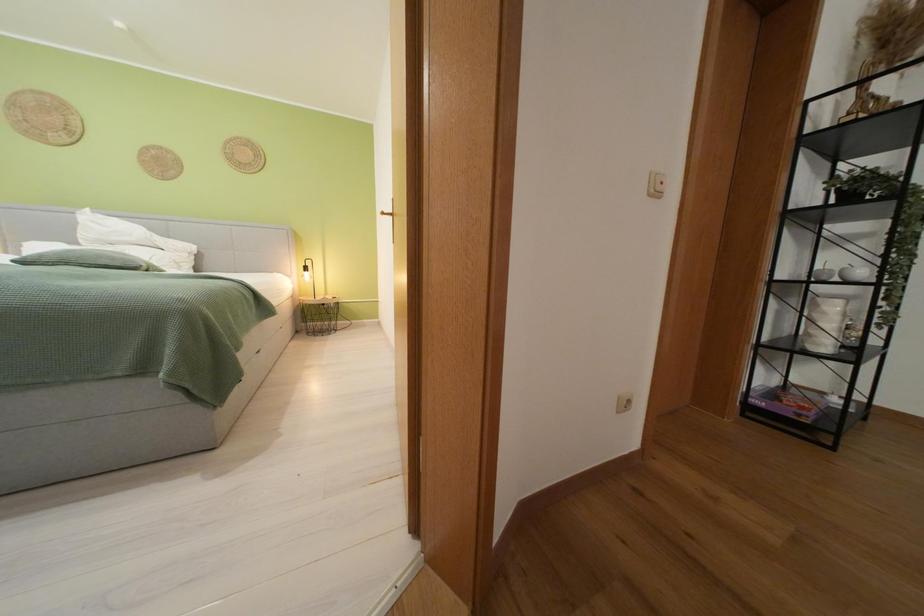
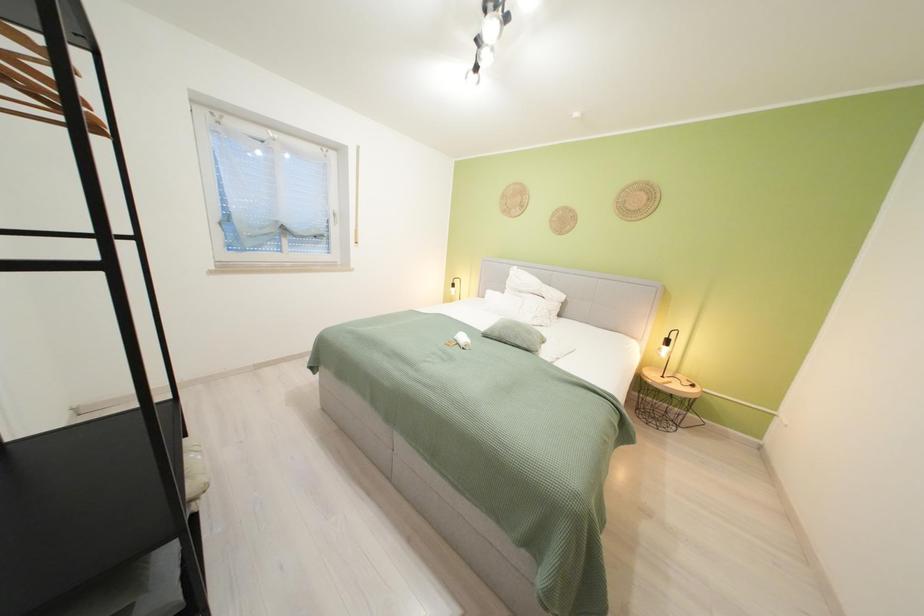
Question: Based on the continuous images, in which direction is the camera rotating? Reply with the corresponding letter.

Choices:
 (A) Left
 (B) Right
 (C) Up
 (D) Down

Answer: (A)